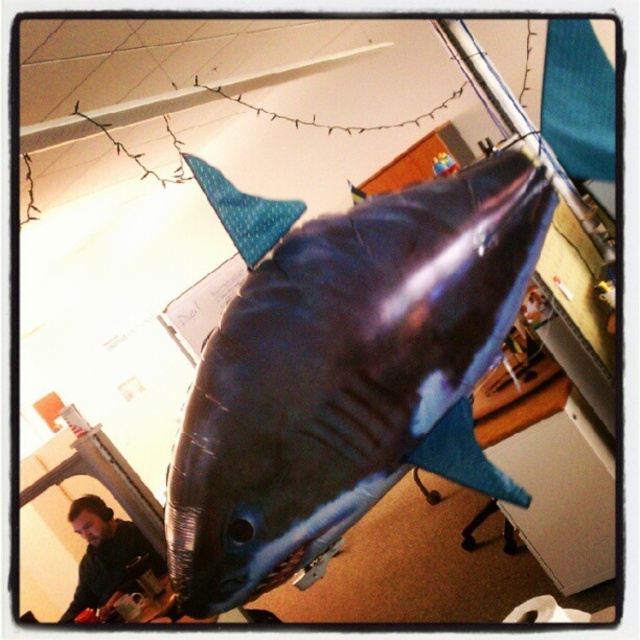
Question: Can you confirm if shiny metallic shark at center is positioned to the left of black matte shirt at lower left?

Choices:
 (A) yes
 (B) no

Answer: (B)

Question: Which point is closer to the camera taking this photo?

Choices:
 (A) (93, 582)
 (B) (282, 372)

Answer: (B)

Question: Among these points, which one is farthest from the camera?

Choices:
 (A) (282, 216)
 (B) (93, 506)
 (C) (273, 502)

Answer: (B)

Question: Can you confirm if black matte shirt at lower left is positioned to the right of blue dotted fabric fin at upper center?

Choices:
 (A) no
 (B) yes

Answer: (A)

Question: Is black matte shirt at lower left smaller than blue dotted fabric fin at upper center?

Choices:
 (A) yes
 (B) no

Answer: (B)

Question: Which point is closer to the camera?

Choices:
 (A) (218, 198)
 (B) (403, 232)

Answer: (B)